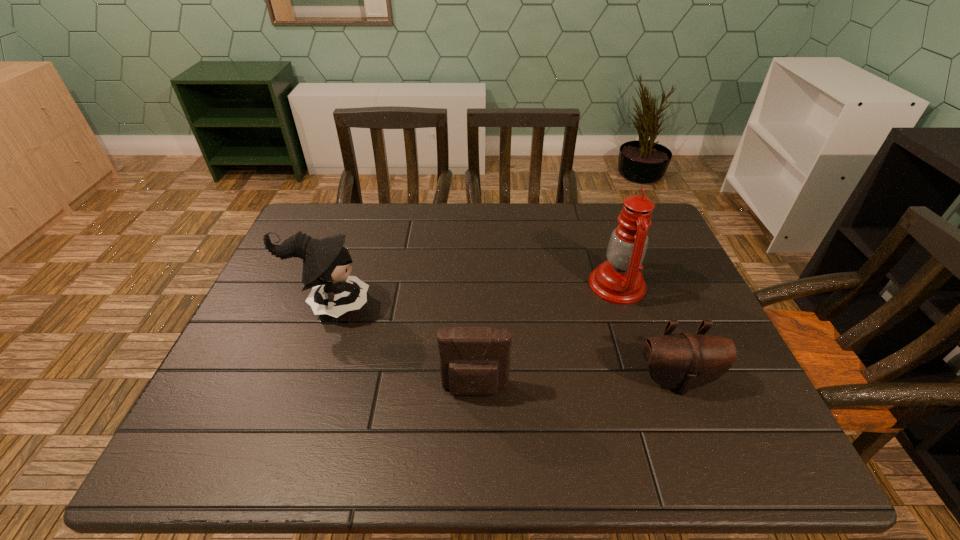
At what (x,y) coordinates should I click in order to perform the action: click on vacant area that satisfies the following two spatial constraints: 1. on the front side of the tallest object; 2. at the face of the doll. Please return your answer as a coordinate pair (x, y). Looking at the image, I should click on (624, 305).